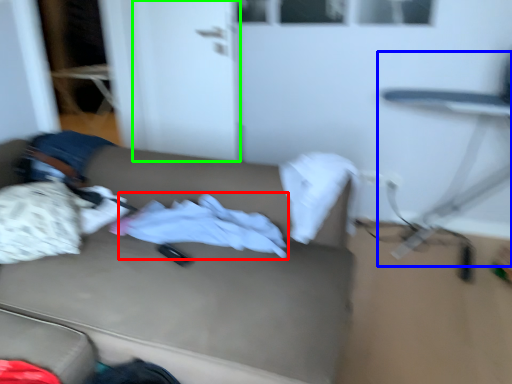
Question: Which object is positioned closest to baby clothe (highlighted by a red box)? Select from swivel chair (highlighted by a blue box) and door (highlighted by a green box).

Choices:
 (A) swivel chair
 (B) door

Answer: (B)